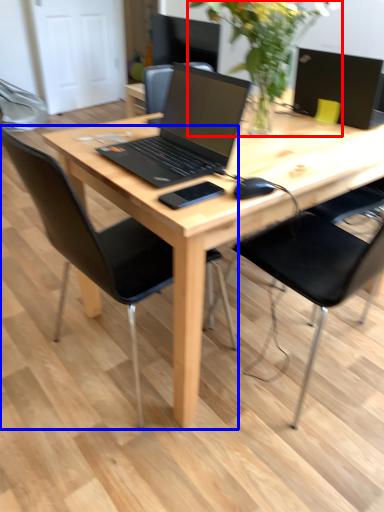
Question: Which object is closer to the camera taking this photo, floral arrangement (highlighted by a red box) or chair (highlighted by a blue box)?

Choices:
 (A) floral arrangement
 (B) chair

Answer: (B)